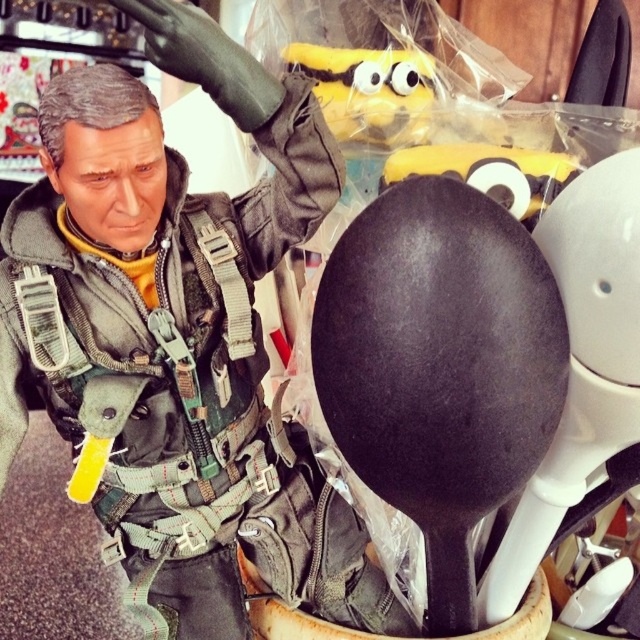
You are organizing a kitchen drawer and need to stack the matte black helmet at upper right and the black matte spoon at center vertically. Which object should you place at the bottom to ensure stability?

The matte black helmet at upper right is much taller than the black matte spoon at center, so placing the taller helmet at the bottom would provide better stability for the stack.

You are organizing a kitchen drawer and see the black matte spoon at center and the yellow plush toy at upper center. Which item should you place to the left side of the drawer to match their arrangement in the image?

You should place the yellow plush toy at upper center to the left side of the drawer because the black matte spoon at center is positioned on the right side of the yellow plush toy at upper center in the image.

What object is located at the coordinates point (x=440, y=365) in the image?

The point (x=440, y=365) is on the black matte spoon at center.